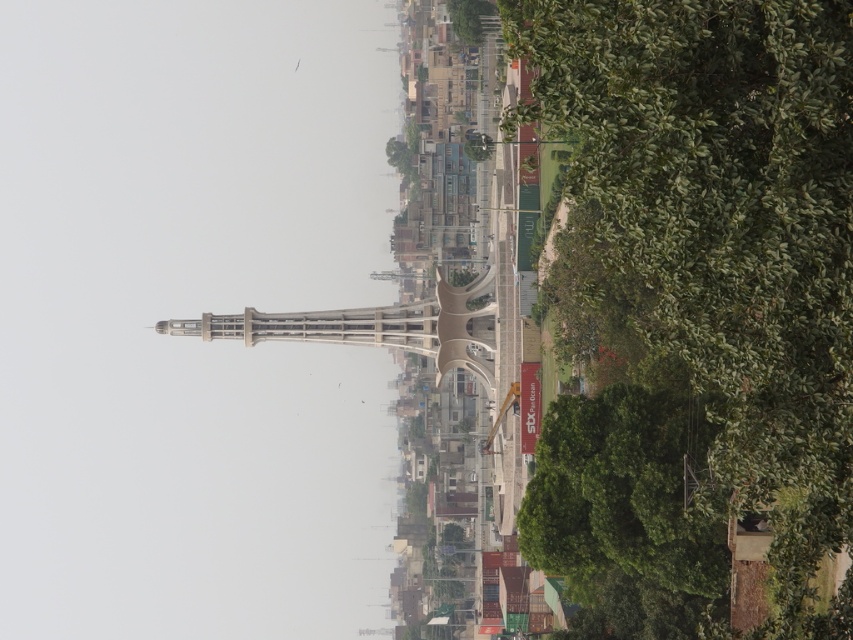
Which is below, green leafy tree at center or green leafy tree at upper center?

Positioned lower is green leafy tree at center.

How much distance is there between green leafy tree at center and green leafy tree at upper center?

green leafy tree at center and green leafy tree at upper center are 163.49 meters apart from each other.

Is point (630, 38) positioned behind point (457, 20)?

No, it is not.

You are a GUI agent. You are given a task and a screenshot of the screen. Output one action in this format:
    pyautogui.click(x=<x>, y=<y>)
    Task: Click on the green leafy tree at center
    Image resolution: width=853 pixels, height=640 pixels.
    Given the screenshot: What is the action you would take?
    pyautogui.click(x=730, y=228)